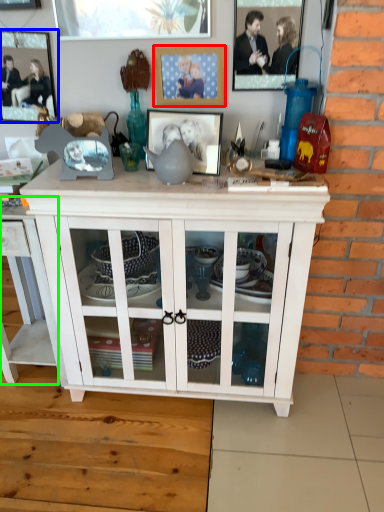
Question: Based on their relative distances, which object is farther from picture frame (highlighted by a red box)? Choose from picture frame (highlighted by a blue box) and table (highlighted by a green box).

Choices:
 (A) picture frame
 (B) table

Answer: (B)